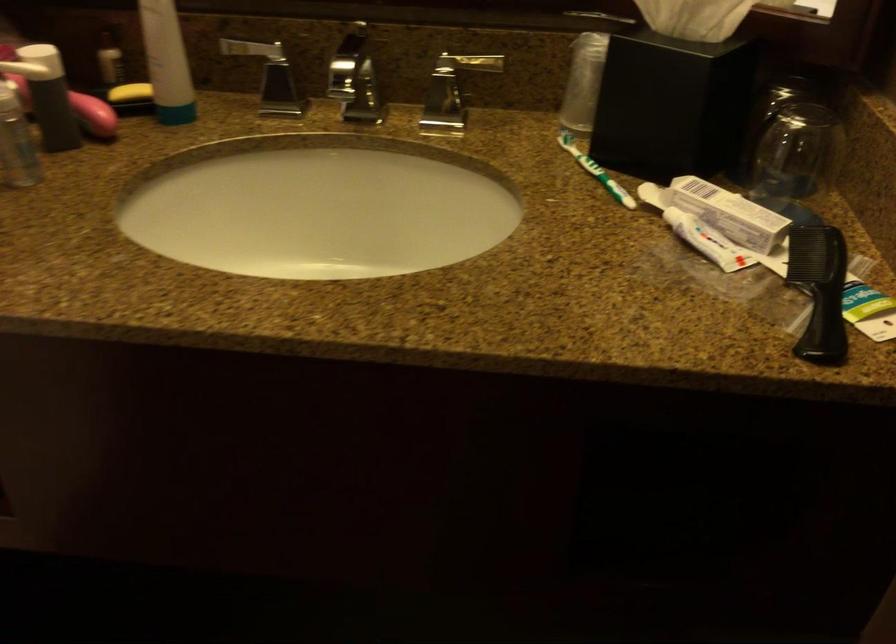
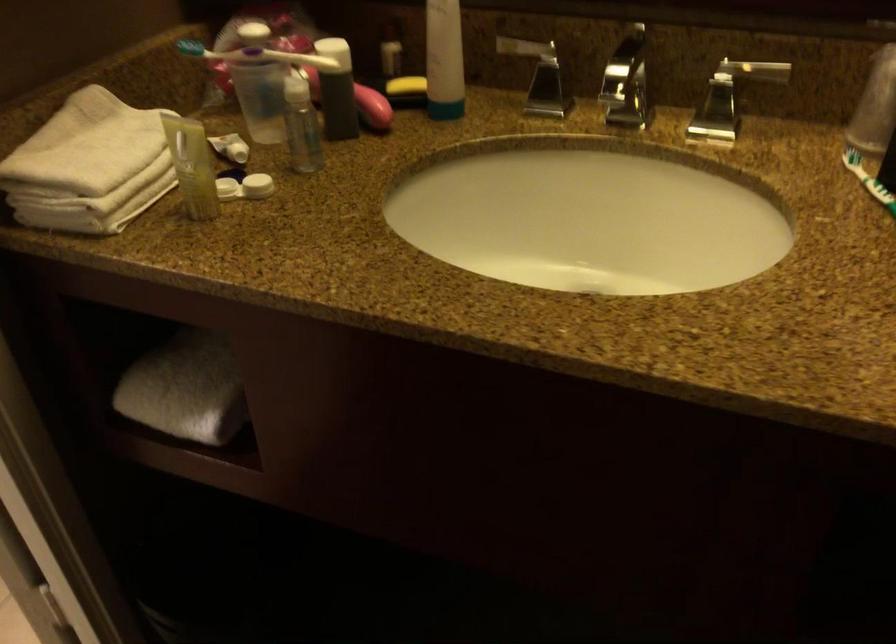
Locate, in the second image, the point that corresponds to point (132, 91) in the first image.

(406, 84)